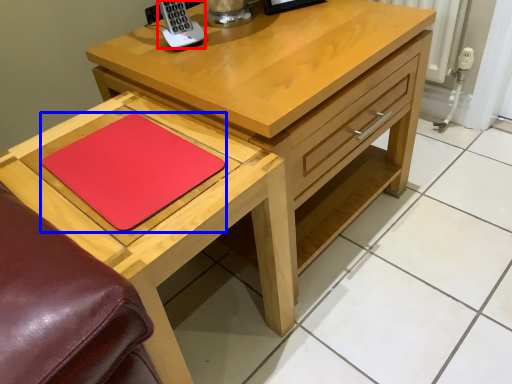
Question: Among these objects, which one is nearest to the camera, appliance (highlighted by a red box) or pad (highlighted by a blue box)?

Choices:
 (A) appliance
 (B) pad

Answer: (B)